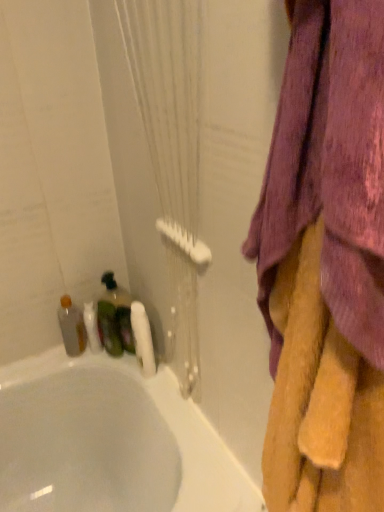
Question: From a real-world perspective, is translucent plastic bottle at left, the second bottle when ordered from right to left, physically located above or below purple fabric towel at upper right?

Choices:
 (A) below
 (B) above

Answer: (A)

Question: From their relative heights in the image, would you say translucent plastic bottle at left, positioned as the 1th bottle in left-to-right order, is taller or shorter than purple fabric towel at upper right?

Choices:
 (A) short
 (B) tall

Answer: (A)

Question: Which object is positioned farthest from the white matte toilet paper at lower left?

Choices:
 (A) translucent plastic bottle at left, positioned as the 1th bottle in left-to-right order
 (B) soft yellow towel at right
 (C) purple fabric towel at upper right
 (D) white textured shower curtain at left
 (E) white glossy bathtub at lower left

Answer: (C)

Question: Which is farther from the soft yellow towel at right?

Choices:
 (A) translucent plastic bottle at left, positioned as the 1th bottle in left-to-right order
 (B) white glossy bathtub at lower left
 (C) purple fabric towel at upper right
 (D) white textured shower curtain at left
 (E) white matte toilet paper at lower left

Answer: (A)